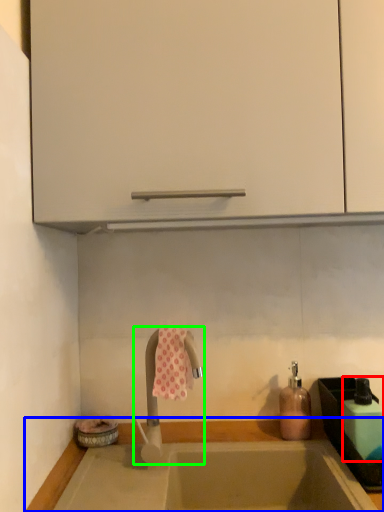
Question: Which object is the closest to the bottle (highlighted by a red box)? Choose among these: countertop (highlighted by a blue box) or tap (highlighted by a green box).

Choices:
 (A) countertop
 (B) tap

Answer: (A)